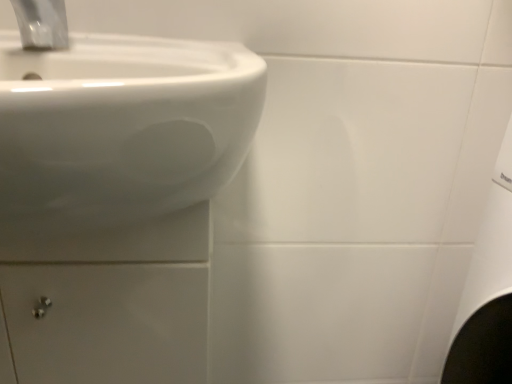
What do you see at coordinates (106, 322) in the screenshot?
I see `white glossy drawer at lower left` at bounding box center [106, 322].

Measure the distance between white glossy drawer at lower left and camera.

A distance of 15.43 inches exists between white glossy drawer at lower left and camera.

In order to click on white glossy drawer at lower left in this screenshot , I will do `click(106, 322)`.

Where is `satin chrome faucet at upper left`? satin chrome faucet at upper left is located at coordinates (42, 23).

Measure the distance between satin chrome faucet at upper left and camera.

A distance of 20.08 inches exists between satin chrome faucet at upper left and camera.

What do you see at coordinates (42, 23) in the screenshot? I see `satin chrome faucet at upper left` at bounding box center [42, 23].

Locate an element on the screen. The image size is (512, 384). white glossy drawer at lower left is located at coordinates (106, 322).

Is satin chrome faucet at upper left to the left of white glossy drawer at lower left from the viewer's perspective?

No.

Which is behind, satin chrome faucet at upper left or white glossy drawer at lower left?

white glossy drawer at lower left.

Does point (32, 10) come in front of point (52, 292)?

No, it is behind (52, 292).

From the image's perspective, is satin chrome faucet at upper left located above white glossy drawer at lower left?

Yes.

From a real-world perspective, which object rests below the other?

white glossy drawer at lower left is physically lower.

Which of these two, satin chrome faucet at upper left or white glossy drawer at lower left, is wider?

white glossy drawer at lower left is wider.

From their relative heights in the image, would you say satin chrome faucet at upper left is taller or shorter than white glossy drawer at lower left?

Clearly, satin chrome faucet at upper left is shorter compared to white glossy drawer at lower left.

Who is smaller, satin chrome faucet at upper left or white glossy drawer at lower left?

With smaller size is satin chrome faucet at upper left.

Is satin chrome faucet at upper left spatially inside white glossy drawer at lower left, or outside of it?

satin chrome faucet at upper left cannot be found inside white glossy drawer at lower left.

Is satin chrome faucet at upper left beside white glossy drawer at lower left?

satin chrome faucet at upper left is not next to white glossy drawer at lower left, and they're not touching.

Does satin chrome faucet at upper left turn towards white glossy drawer at lower left?

No, satin chrome faucet at upper left is not turned towards white glossy drawer at lower left.

In the scene shown: How different are the orientations of satin chrome faucet at upper left and white glossy drawer at lower left in degrees?

The facing directions of satin chrome faucet at upper left and white glossy drawer at lower left are 0.338 degrees apart.

What are the coordinates of `tap that appears above the white glossy drawer at lower left (from a real-world perspective)` in the screenshot? It's located at (42, 23).

Does white glossy drawer at lower left appear on the right side of satin chrome faucet at upper left?

Incorrect, white glossy drawer at lower left is not on the right side of satin chrome faucet at upper left.

Between white glossy drawer at lower left and satin chrome faucet at upper left, which one is positioned in front?

Positioned in front is satin chrome faucet at upper left.

Is point (24, 268) positioned behind point (49, 38)?

No, (24, 268) is in front of (49, 38).

From the image's perspective, does white glossy drawer at lower left appear lower than satin chrome faucet at upper left?

Correct, white glossy drawer at lower left appears lower than satin chrome faucet at upper left in the image.

From a real-world perspective, is white glossy drawer at lower left below satin chrome faucet at upper left?

Correct, in the physical world, white glossy drawer at lower left is lower than satin chrome faucet at upper left.

Can you confirm if white glossy drawer at lower left is thinner than satin chrome faucet at upper left?

No, white glossy drawer at lower left is not thinner than satin chrome faucet at upper left.

From their relative heights in the image, would you say white glossy drawer at lower left is taller or shorter than satin chrome faucet at upper left?

white glossy drawer at lower left is taller than satin chrome faucet at upper left.

Does white glossy drawer at lower left have a larger size compared to satin chrome faucet at upper left?

Yes.

Is satin chrome faucet at upper left located within white glossy drawer at lower left?

That's incorrect, satin chrome faucet at upper left is not inside white glossy drawer at lower left.

Is white glossy drawer at lower left with satin chrome faucet at upper left?

No.

Is white glossy drawer at lower left turned away from satin chrome faucet at upper left?

No.

Looking at this image, how different are the orientations of white glossy drawer at lower left and satin chrome faucet at upper left in degrees?

There is a 0.338-degree angle between the facing directions of white glossy drawer at lower left and satin chrome faucet at upper left.

Find the location of `drawer located behind the satin chrome faucet at upper left`. drawer located behind the satin chrome faucet at upper left is located at coordinates (106, 322).

This screenshot has height=384, width=512. Find the location of `drawer lying on the left of satin chrome faucet at upper left`. drawer lying on the left of satin chrome faucet at upper left is located at coordinates (106, 322).

In the image, there is a white glossy drawer at lower left. Where is `tap above it (from the image's perspective)`? The height and width of the screenshot is (384, 512). tap above it (from the image's perspective) is located at coordinates (42, 23).